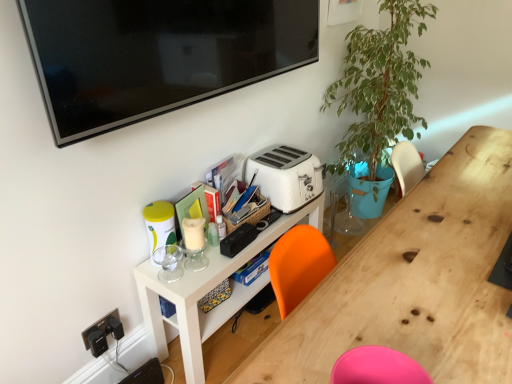
Question: Can you confirm if white plastic toaster at center is positioned to the right of wooden desk at center?

Choices:
 (A) yes
 (B) no

Answer: (B)

Question: Is white plastic toaster at center aimed at wooden desk at center?

Choices:
 (A) no
 (B) yes

Answer: (B)

Question: Is white plastic toaster at center outside wooden desk at center?

Choices:
 (A) no
 (B) yes

Answer: (B)

Question: Is wooden desk at center surrounded by white plastic toaster at center?

Choices:
 (A) yes
 (B) no

Answer: (B)

Question: Is white plastic toaster at center placed right next to wooden desk at center?

Choices:
 (A) yes
 (B) no

Answer: (B)

Question: Does white plastic toaster at center appear on the left side of wooden desk at center?

Choices:
 (A) no
 (B) yes

Answer: (B)

Question: From the image's perspective, is wooden desk at center on white plastic toaster at center?

Choices:
 (A) no
 (B) yes

Answer: (A)

Question: From the image's perspective, is wooden desk at center under white plastic toaster at center?

Choices:
 (A) no
 (B) yes

Answer: (B)

Question: Considering the relative sizes of wooden desk at center and white plastic toaster at center in the image provided, is wooden desk at center bigger than white plastic toaster at center?

Choices:
 (A) no
 (B) yes

Answer: (B)

Question: Could white plastic toaster at center be considered to be inside wooden desk at center?

Choices:
 (A) no
 (B) yes

Answer: (A)

Question: Is wooden desk at center aimed at white plastic toaster at center?

Choices:
 (A) yes
 (B) no

Answer: (B)

Question: Does wooden desk at center have a smaller size compared to white plastic toaster at center?

Choices:
 (A) no
 (B) yes

Answer: (A)

Question: Is white matte shelf at center inside white plastic toaster at center?

Choices:
 (A) yes
 (B) no

Answer: (B)